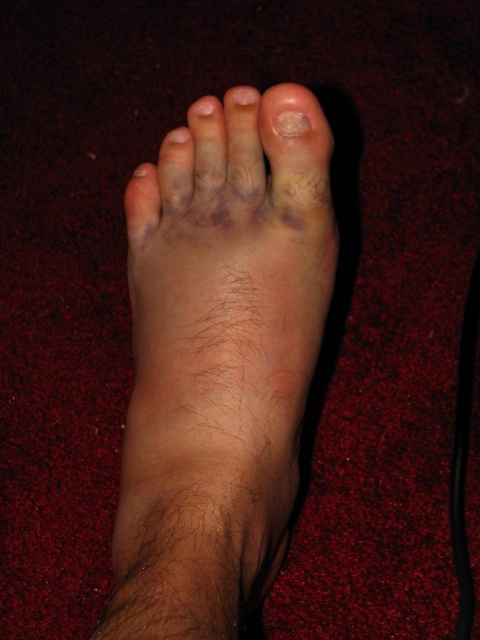
Between dry skin foot at center and pale skin toe at upper center, which one appears on the left side from the viewer's perspective?

dry skin foot at center

Find the location of a particular element. This screenshot has height=640, width=480. dry skin foot at center is located at coordinates (218, 358).